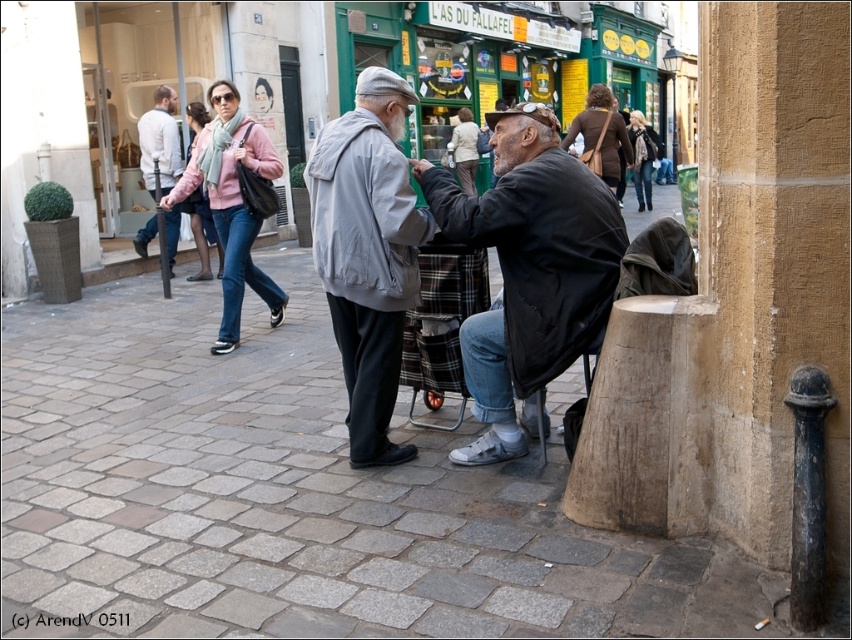
You are a delivery person who needs to place a small package on the plaid fabric chair at center. However, there is a white cotton sweater at left nearby. How far apart are these two items?

The plaid fabric chair at center is 6.64 meters away from the white cotton sweater at left.

You are a delivery person who needs to place a small package on either the plaid fabric chair at center or the white cotton sweater at left. Based on their sizes, which object would be more suitable for placing the package without it falling off?

The plaid fabric chair at center has a smaller size compared to the white cotton sweater at left, so the white cotton sweater at left would be more suitable for placing the small package as it offers a larger surface area to prevent the package from falling off.

You are standing on the cobblestone street and want to walk towards the two points marked in the image. Which point, point (613, 237) or point (465, 257), will you reach first?

Point (613, 237) is closer to the viewer than point (465, 257), so you will reach point (613, 237) first.